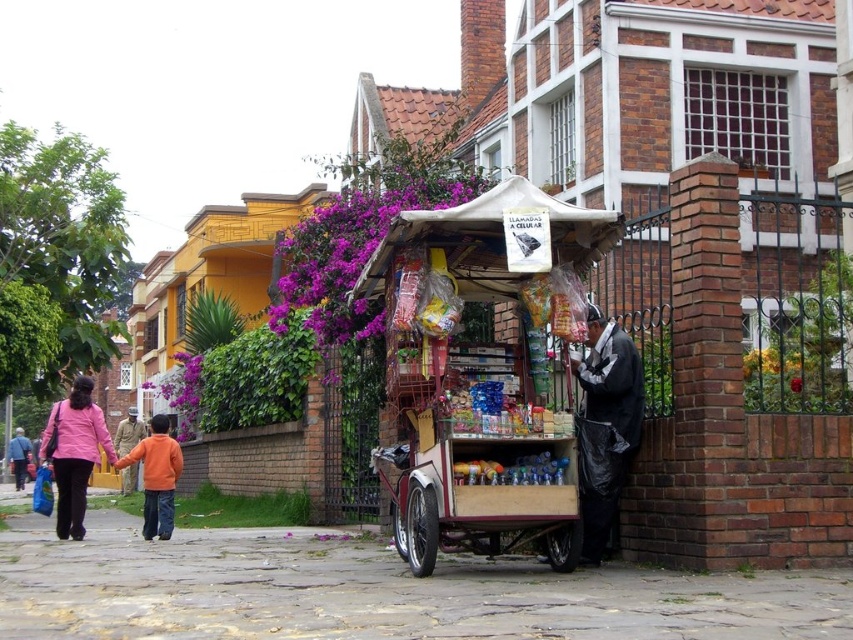
Question: Which point is farther to the camera?

Choices:
 (A) orange cotton jacket at lower left
 (B) paved stone at lower left
 (C) black plastic bag at lower right
 (D) orange cotton shirt at lower left

Answer: (A)

Question: Among these objects, which one is farthest from the camera?

Choices:
 (A) orange cotton shirt at lower left
 (B) matte pink sweater at left

Answer: (A)

Question: Does paved stone at lower left have a smaller size compared to orange cotton shirt at lower left?

Choices:
 (A) no
 (B) yes

Answer: (B)

Question: Is paved stone at lower left thinner than orange cotton shirt at lower left?

Choices:
 (A) no
 (B) yes

Answer: (A)

Question: Which object appears closest to the camera in this image?

Choices:
 (A) black plastic bag at lower right
 (B) purple matte flowers at center

Answer: (A)

Question: Can you confirm if black plastic bag at lower right is smaller than orange cotton shirt at lower left?

Choices:
 (A) no
 (B) yes

Answer: (B)